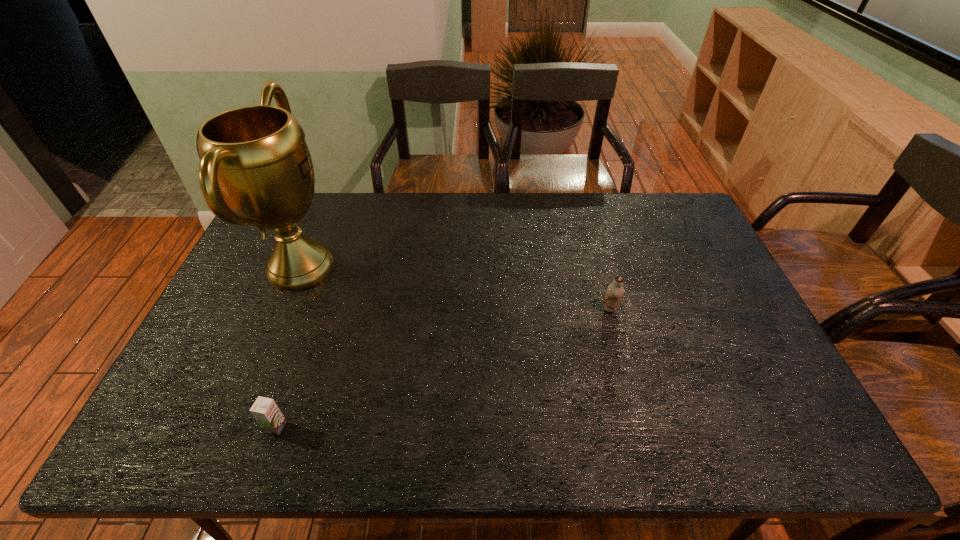
Identify the location of object situated at the left edge. (255, 159).

I want to click on object present at the far left corner, so click(x=255, y=159).

Locate an element on the screen. The image size is (960, 540). vacant space at the far edge is located at coordinates (332, 194).

I want to click on blank space at the near edge, so click(404, 451).

The image size is (960, 540). I want to click on vacant position at the left edge of the desktop, so click(254, 239).

Identify the location of vacant point located between the trophy cup and the shortest object. The height and width of the screenshot is (540, 960). coord(288,347).

Locate an element on the screen. Image resolution: width=960 pixels, height=540 pixels. vacant area between the trophy cup and the rightmost object is located at coordinates (455, 288).

Find the location of a particular element. The width and height of the screenshot is (960, 540). unoccupied area between the tallest object and the rightmost object is located at coordinates (455, 288).

Locate an element on the screen. The height and width of the screenshot is (540, 960). vacant region between the left chocolate milk and the tallest object is located at coordinates (288, 347).

Locate an element on the screen. The width and height of the screenshot is (960, 540). vacant area between the right chocolate milk and the trophy cup is located at coordinates (455, 288).